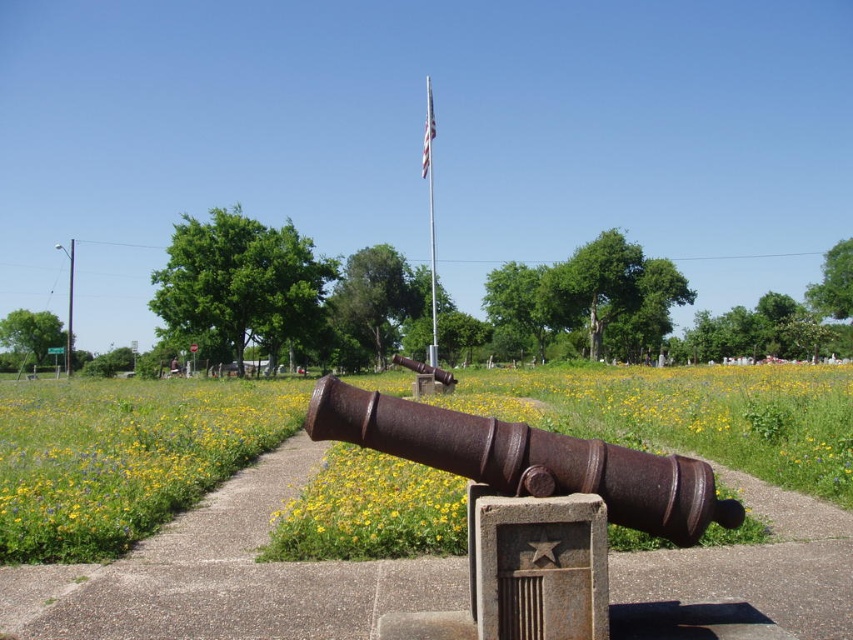
Does silver metallic flag pole at center have a smaller size compared to brushed metal pole at upper left?

Indeed, silver metallic flag pole at center has a smaller size compared to brushed metal pole at upper left.

Who is taller, silver metallic flag pole at center or brushed metal pole at upper left?

silver metallic flag pole at center is taller.

The image size is (853, 640). Identify the location of silver metallic flag pole at center. (430, 212).

Who is higher up, green grassy at center or white fabric flag at center?

white fabric flag at center

Is green grassy at center wider than white fabric flag at center?

Correct, the width of green grassy at center exceeds that of white fabric flag at center.

Which is behind, point (38, 520) or point (421, 160)?

Point (421, 160)

Locate an element on the screen. The image size is (853, 640). green grassy at center is located at coordinates (125, 456).

Does green grassy at center have a greater width compared to brushed metal pole at upper left?

Indeed, green grassy at center has a greater width compared to brushed metal pole at upper left.

Is point (39, 500) farther from viewer compared to point (71, 262)?

No.

This screenshot has width=853, height=640. I want to click on green grassy at center, so click(x=125, y=456).